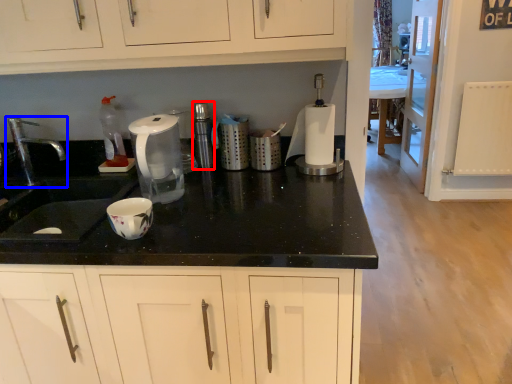
Question: Which object is further to the camera taking this photo, appliance (highlighted by a red box) or tap (highlighted by a blue box)?

Choices:
 (A) appliance
 (B) tap

Answer: (A)